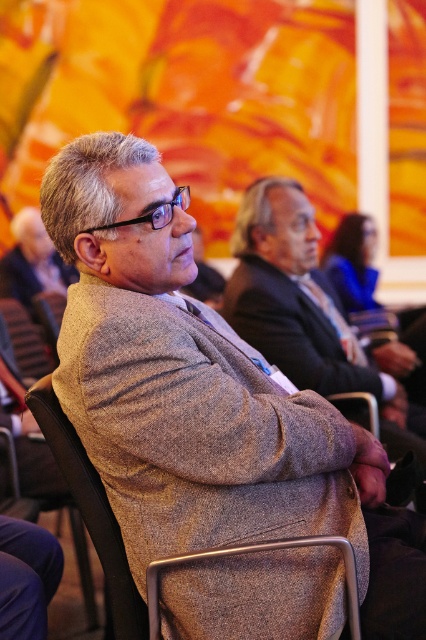
In the scene shown: Between gray woolen suit at center and textured wool coat at center, which one appears on the left side from the viewer's perspective?

textured wool coat at center

Does gray woolen suit at center come behind textured wool coat at center?

Yes, it is.

Is point (256, 228) behind point (103, 500)?

Yes, it is.

Find the location of a particular element. The width and height of the screenshot is (426, 640). gray woolen suit at center is located at coordinates (302, 307).

Describe the element at coordinates (184, 380) in the screenshot. This screenshot has width=426, height=640. I see `textured gray blazer at center` at that location.

Does textured gray blazer at center appear on the right side of gray woolen suit at center?

No, textured gray blazer at center is not to the right of gray woolen suit at center.

Which is in front, point (210, 632) or point (379, 396)?

Point (210, 632)

Find the location of a particular element. This screenshot has width=426, height=640. textured gray blazer at center is located at coordinates (184, 380).

Who is lower down, textured gray blazer at center or matte gray coat at center?

Positioned lower is textured gray blazer at center.

Is point (175, 472) farther from camera compared to point (51, 289)?

No.

Identify the location of textured gray blazer at center. Image resolution: width=426 pixels, height=640 pixels. (184, 380).

Where is `textured gray blazer at center`? textured gray blazer at center is located at coordinates (184, 380).